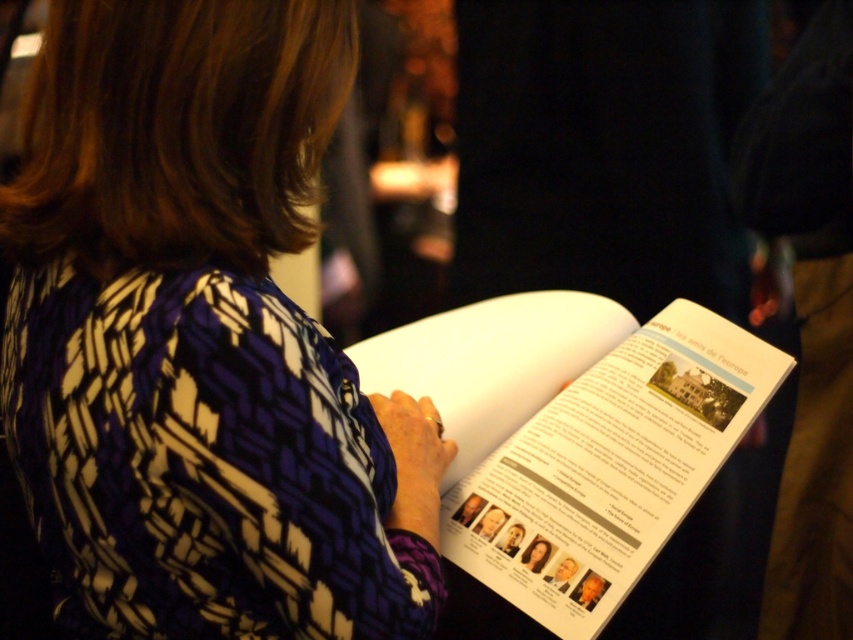
Does printed fabric shirt at center have a larger size compared to white paper book at center?

Actually, printed fabric shirt at center might be smaller than white paper book at center.

Between printed fabric shirt at center and white paper book at center, which one appears on the right side from the viewer's perspective?

Positioned to the right is white paper book at center.

Is point (234, 145) positioned before point (506, 314)?

Yes, it is in front of point (506, 314).

This screenshot has height=640, width=853. Identify the location of printed fabric shirt at center. (200, 339).